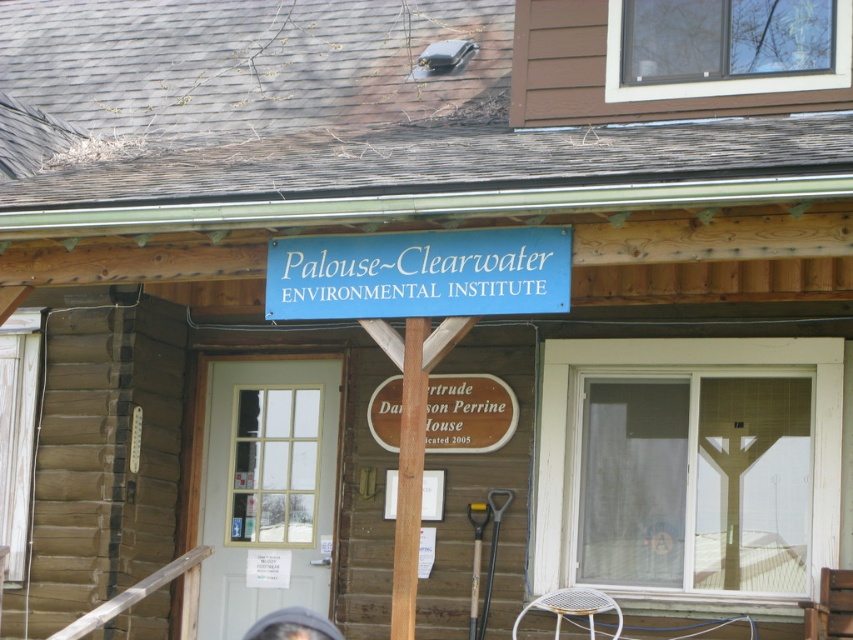
Does point (376, 289) come behind point (262, 621)?

No, (376, 289) is closer to viewer.

Who is more distant from viewer, (434,266) or (299,608)?

Positioned behind is point (299,608).

Where is `blue matte sign at center`? blue matte sign at center is located at coordinates (419, 273).